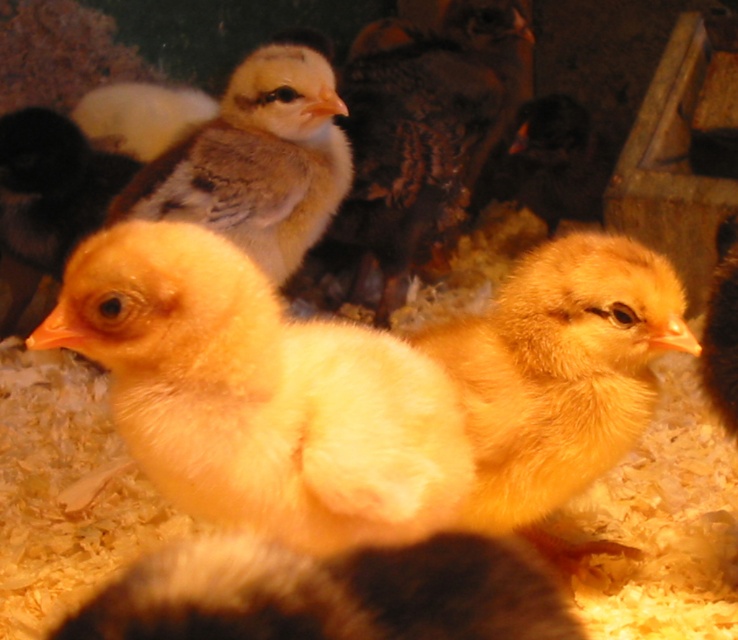
Does point (606, 321) come farther from viewer compared to point (297, 212)?

No.

Does fluffy yellow chick at center appear on the right side of soft yellow chick at center?

Yes, fluffy yellow chick at center is to the right of soft yellow chick at center.

Which is in front, point (624, 289) or point (308, 241)?

Point (624, 289)

Where is `fluffy yellow chick at center`? The width and height of the screenshot is (738, 640). fluffy yellow chick at center is located at coordinates (559, 378).

Which is more to the left, yellow downy chick at center or fluffy yellow chick at center?

Positioned to the left is yellow downy chick at center.

Consider the image. Does yellow downy chick at center have a lesser height compared to fluffy yellow chick at center?

Yes, yellow downy chick at center is shorter than fluffy yellow chick at center.

Image resolution: width=738 pixels, height=640 pixels. Describe the element at coordinates (258, 394) in the screenshot. I see `yellow downy chick at center` at that location.

Find the location of a particular element. This screenshot has width=738, height=640. yellow downy chick at center is located at coordinates (258, 394).

Between yellow downy chick at center and soft yellow chick at center, which one appears on the left side from the viewer's perspective?

soft yellow chick at center

Is yellow downy chick at center positioned at the back of soft yellow chick at center?

No.

You are a GUI agent. You are given a task and a screenshot of the screen. Output one action in this format:
    pyautogui.click(x=<x>, y=<y>)
    Task: Click on the yellow downy chick at center
    The image size is (738, 640).
    Given the screenshot: What is the action you would take?
    pyautogui.click(x=258, y=394)

You are a GUI agent. You are given a task and a screenshot of the screen. Output one action in this format:
    pyautogui.click(x=<x>, y=<y>)
    Task: Click on the yellow downy chick at center
    This screenshot has height=640, width=738.
    Given the screenshot: What is the action you would take?
    pyautogui.click(x=258, y=394)